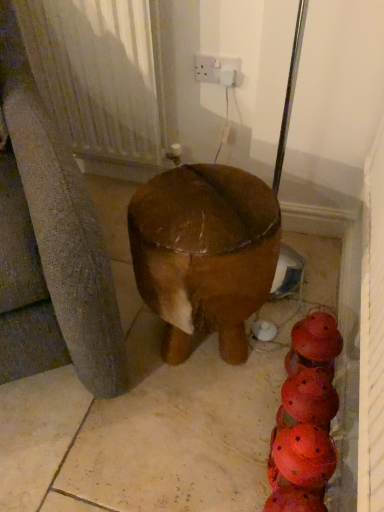
Question: Does white textured radiator at upper left have a lesser width compared to white plastic socket at upper center?

Choices:
 (A) yes
 (B) no

Answer: (B)

Question: Is white textured radiator at upper left looking in the opposite direction of white plastic socket at upper center?

Choices:
 (A) yes
 (B) no

Answer: (B)

Question: Would you say white textured radiator at upper left is outside white plastic socket at upper center?

Choices:
 (A) no
 (B) yes

Answer: (B)

Question: From the image's perspective, is white textured radiator at upper left above white plastic socket at upper center?

Choices:
 (A) no
 (B) yes

Answer: (A)

Question: Is the depth of white textured radiator at upper left less than that of white plastic socket at upper center?

Choices:
 (A) yes
 (B) no

Answer: (A)

Question: Is white textured radiator at upper left spatially inside brown polished wood stool at center, or outside of it?

Choices:
 (A) outside
 (B) inside

Answer: (A)

Question: Considering their positions, is white textured radiator at upper left located in front of or behind brown polished wood stool at center?

Choices:
 (A) front
 (B) behind

Answer: (B)

Question: In terms of size, does white textured radiator at upper left appear bigger or smaller than brown polished wood stool at center?

Choices:
 (A) small
 (B) big

Answer: (A)

Question: In terms of width, does white textured radiator at upper left look wider or thinner when compared to brown polished wood stool at center?

Choices:
 (A) wide
 (B) thin

Answer: (B)

Question: In the image, is brown polished wood stool at center on the left side or the right side of white textured radiator at upper left?

Choices:
 (A) right
 (B) left

Answer: (A)

Question: Considering their positions, is brown polished wood stool at center located in front of or behind white textured radiator at upper left?

Choices:
 (A) front
 (B) behind

Answer: (A)

Question: From a real-world perspective, is brown polished wood stool at center physically located above or below white textured radiator at upper left?

Choices:
 (A) below
 (B) above

Answer: (A)

Question: Is brown polished wood stool at center bigger or smaller than white textured radiator at upper left?

Choices:
 (A) big
 (B) small

Answer: (A)

Question: Relative to brown polished wood stool at center, is white plastic socket at upper center in front or behind?

Choices:
 (A) behind
 (B) front

Answer: (A)

Question: From a real-world perspective, is white plastic socket at upper center positioned above or below brown polished wood stool at center?

Choices:
 (A) above
 (B) below

Answer: (A)